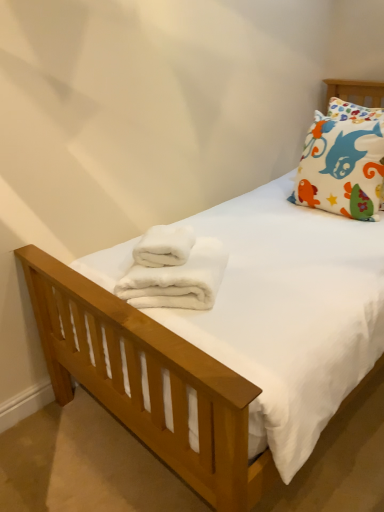
Question: Is the position of white fluffy bath towel at center, the first bath towel when ordered from top to bottom, less distant than that of white fluffy bath towel at center, the 1th bath towel positioned from the bottom?

Choices:
 (A) no
 (B) yes

Answer: (A)

Question: Can you confirm if white fluffy bath towel at center, which appears as the 2th bath towel when ordered from the bottom, is wider than white fluffy bath towel at center, the 1th bath towel positioned from the bottom?

Choices:
 (A) yes
 (B) no

Answer: (B)

Question: Does white fluffy bath towel at center, the first bath towel when ordered from top to bottom, lie behind white fluffy bath towel at center, the second bath towel in the top-to-bottom sequence?

Choices:
 (A) no
 (B) yes

Answer: (B)

Question: From a real-world perspective, is white fluffy bath towel at center, the first bath towel when ordered from top to bottom, on top of white fluffy bath towel at center, the second bath towel in the top-to-bottom sequence?

Choices:
 (A) yes
 (B) no

Answer: (A)

Question: Are white fluffy bath towel at center, the first bath towel when ordered from top to bottom, and white fluffy bath towel at center, the second bath towel in the top-to-bottom sequence, beside each other?

Choices:
 (A) no
 (B) yes

Answer: (B)

Question: From the image's perspective, is white fluffy bath towel at center, which appears as the 2th bath towel when ordered from the bottom, above white fluffy bath towel at center, the 1th bath towel positioned from the bottom?

Choices:
 (A) no
 (B) yes

Answer: (B)

Question: Is white fluffy bath towel at center, which appears as the 2th bath towel when ordered from the bottom, surrounding white cotton pillow at upper right?

Choices:
 (A) yes
 (B) no

Answer: (B)

Question: Is the position of white fluffy bath towel at center, the first bath towel when ordered from top to bottom, more distant than that of white cotton pillow at upper right?

Choices:
 (A) yes
 (B) no

Answer: (B)

Question: Is white fluffy bath towel at center, the first bath towel when ordered from top to bottom, positioned beyond the bounds of white cotton pillow at upper right?

Choices:
 (A) no
 (B) yes

Answer: (B)

Question: From the image's perspective, is white fluffy bath towel at center, which appears as the 2th bath towel when ordered from the bottom, located beneath white cotton pillow at upper right?

Choices:
 (A) no
 (B) yes

Answer: (B)

Question: Considering the relative positions of white fluffy bath towel at center, the first bath towel when ordered from top to bottom, and white cotton pillow at upper right in the image provided, is white fluffy bath towel at center, the first bath towel when ordered from top to bottom, to the right of white cotton pillow at upper right from the viewer's perspective?

Choices:
 (A) yes
 (B) no

Answer: (B)

Question: From a real-world perspective, is white fluffy bath towel at center, which appears as the 2th bath towel when ordered from the bottom, physically below white cotton pillow at upper right?

Choices:
 (A) yes
 (B) no

Answer: (A)

Question: Is white fluffy bath towel at center, the second bath towel in the top-to-bottom sequence, located within white cotton pillow at upper right?

Choices:
 (A) yes
 (B) no

Answer: (B)